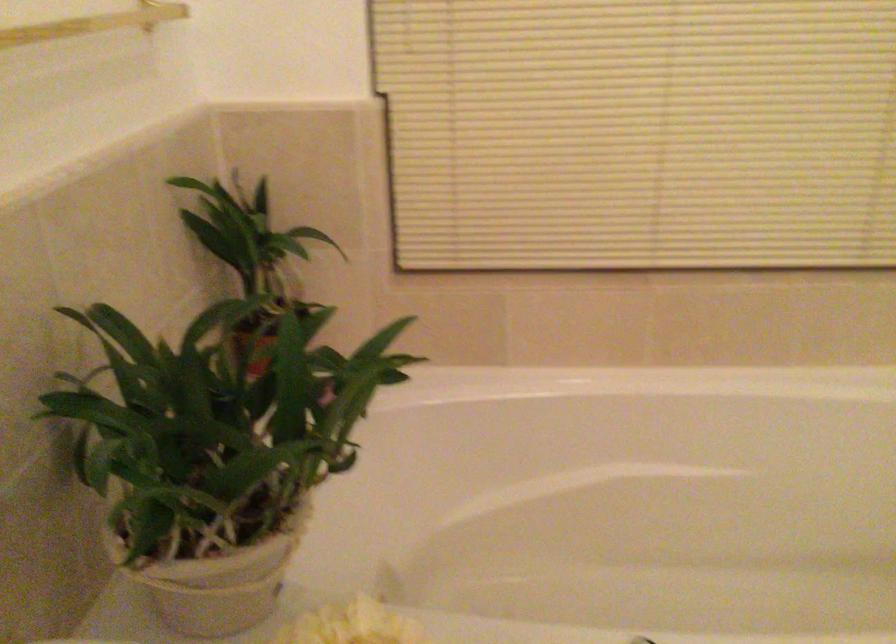
Find the location of `gold towel bar`. gold towel bar is located at coordinates (92, 23).